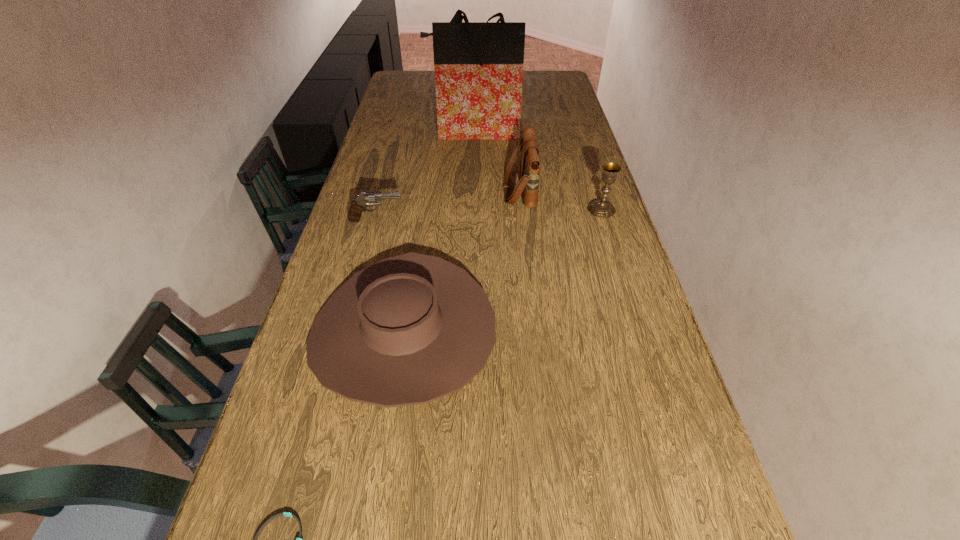
Identify the location of blank space located 0.220m on the front-facing side of the shoulder bag. The width and height of the screenshot is (960, 540). (437, 190).

The height and width of the screenshot is (540, 960). Identify the location of free space located on the left of the rightmost object. (465, 210).

The height and width of the screenshot is (540, 960). Find the location of `vacant space positioned 0.240m on the back of the fifth farthest object`. vacant space positioned 0.240m on the back of the fifth farthest object is located at coordinates (421, 214).

What are the coordinates of `vacant space located at the barrel of the pistol` in the screenshot? It's located at (530, 220).

You are a GUI agent. You are given a task and a screenshot of the screen. Output one action in this format:
    pyautogui.click(x=<x>, y=<y>)
    Task: Click on the cowboy hat located at the left edge
    This screenshot has width=960, height=540.
    Given the screenshot: What is the action you would take?
    pyautogui.click(x=410, y=329)

Where is `pistol positioned at the left edge`? This screenshot has width=960, height=540. pistol positioned at the left edge is located at coordinates (366, 198).

Identify the location of object that is positioned at the right edge. The height and width of the screenshot is (540, 960). (600, 208).

This screenshot has height=540, width=960. In the image, there is a desktop. Identify the location of free space at the right edge. (583, 199).

Find the location of a particular element. The height and width of the screenshot is (540, 960). vacant space at the far right corner of the desktop is located at coordinates (561, 80).

In order to click on unoccupied position between the shoulder bag and the fifth farthest object in this screenshot , I will do `click(462, 261)`.